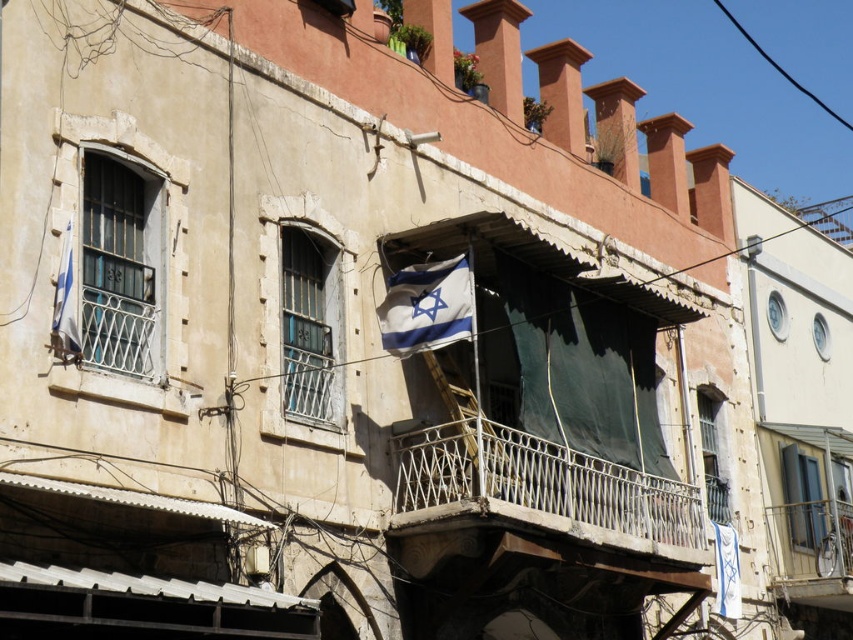
Question: Which point is farther to the camera?

Choices:
 (A) blue fabric flag at center
 (B) metallic white balcony at center

Answer: (A)

Question: Can you confirm if metallic white balcony at center is positioned to the right of blue fabric flag at center?

Choices:
 (A) yes
 (B) no

Answer: (A)

Question: In this image, where is blue fabric flag at center located relative to blue-white fabric flag at left?

Choices:
 (A) below
 (B) above

Answer: (A)

Question: Which object is positioned farthest from the metallic white balcony at center?

Choices:
 (A) blue-white fabric flag at left
 (B) blue fabric flag at center

Answer: (A)

Question: Can you confirm if metallic white balcony at center is positioned to the right of blue fabric flag at center?

Choices:
 (A) no
 (B) yes

Answer: (B)

Question: Which object appears farthest from the camera in this image?

Choices:
 (A) metallic white balcony at center
 (B) blue-white fabric flag at left

Answer: (A)